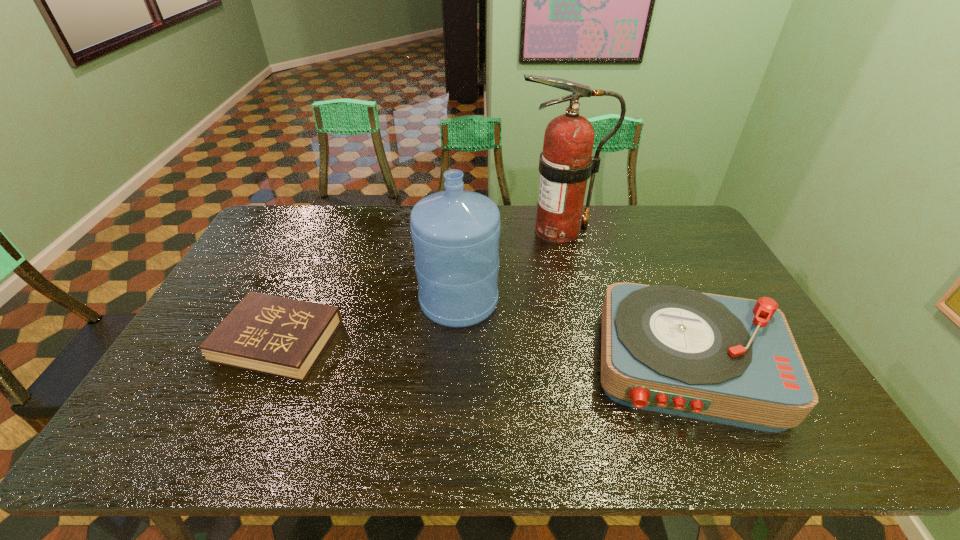
The width and height of the screenshot is (960, 540). In order to click on fire extinguisher in this screenshot , I will do `click(566, 163)`.

The height and width of the screenshot is (540, 960). Find the location of `the tallest object`. the tallest object is located at coordinates (566, 163).

Where is `water jug`? This screenshot has height=540, width=960. water jug is located at coordinates (455, 233).

Where is `the second tallest object`? the second tallest object is located at coordinates (455, 233).

Find the location of a particular element. The height and width of the screenshot is (540, 960). record player is located at coordinates (664, 348).

Locate an element on the screen. hardback book is located at coordinates (279, 336).

This screenshot has width=960, height=540. What are the coordinates of `the shortest object` in the screenshot? It's located at (279, 336).

In order to click on vacant region located 0.210m at the nozzle of the fire extinguisher in this screenshot , I will do (456, 230).

Where is `vacant space situated at the nozzle of the fire extinguisher`? This screenshot has width=960, height=540. vacant space situated at the nozzle of the fire extinguisher is located at coordinates (481, 230).

You are a GUI agent. You are given a task and a screenshot of the screen. Output one action in this format:
    pyautogui.click(x=<x>, y=<y>)
    Task: Click on the free location located 0.170m at the nozzle of the fire extinguisher
    The height and width of the screenshot is (540, 960).
    Given the screenshot: What is the action you would take?
    pyautogui.click(x=468, y=230)